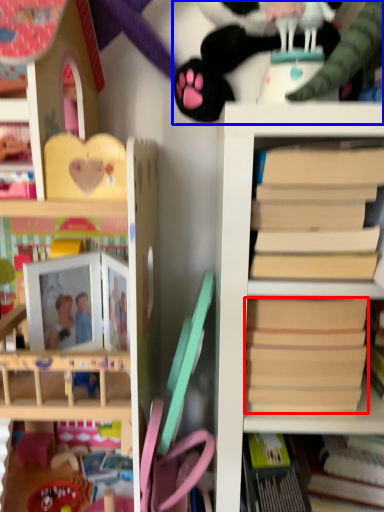
Question: Among these objects, which one is farthest to the camera, paperback book (highlighted by a red box) or toy (highlighted by a blue box)?

Choices:
 (A) paperback book
 (B) toy

Answer: (B)